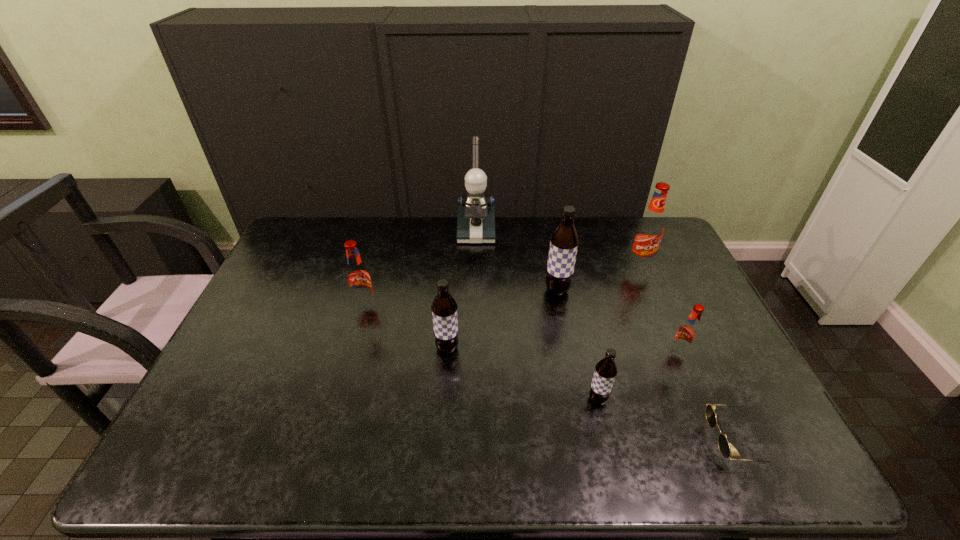
Identify the location of the second nearest object. The width and height of the screenshot is (960, 540). (605, 372).

Locate an element on the screen. The width and height of the screenshot is (960, 540). the nearest brown root beer is located at coordinates (605, 372).

The height and width of the screenshot is (540, 960). Identify the location of the shortest object. (723, 444).

This screenshot has height=540, width=960. Find the location of `the nearest object`. the nearest object is located at coordinates (723, 444).

You are a GUI agent. You are given a task and a screenshot of the screen. Output one action in this format:
    pyautogui.click(x=<x>, y=<y>)
    Task: Click on the vacant space located on the right of the farthest object
    
    Given the screenshot: What is the action you would take?
    pyautogui.click(x=540, y=231)

Identify the location of free space located 0.230m on the left of the farthest root beer. (560, 264).

At what (x,y) coordinates should I click in order to perform the action: click on free space located on the right of the biggest brown root beer. Please return your answer as a coordinate pair (x, y). The image size is (960, 540). Looking at the image, I should click on (637, 291).

Locate an element on the screen. vacant area located on the front of the leftmost object is located at coordinates (344, 382).

The height and width of the screenshot is (540, 960). I want to click on vacant space located 0.240m on the left of the leftmost brown root beer, so click(348, 348).

Where is `free space located 0.080m on the right of the smallest red root beer`? The width and height of the screenshot is (960, 540). free space located 0.080m on the right of the smallest red root beer is located at coordinates (717, 354).